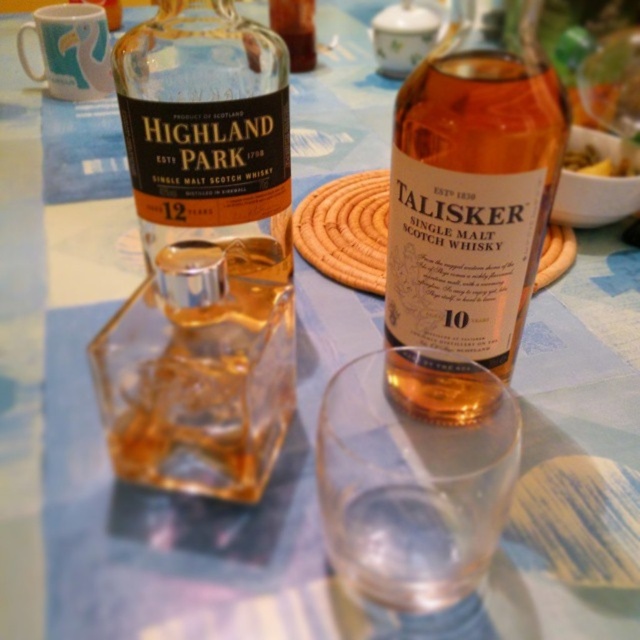
You are at a bar and see two bottles of Scotch whisky on the table. The bottles are labeled as matte glass bottle at center and amber glass bottle at center. Which one is positioned to the left?

The matte glass bottle at center is positioned to the left of the amber glass bottle at center.

You are at a restaurant and see both the amber glass bottle at center and the golden crispy fries at center on the table. Which item is closer to the edge of the table?

The golden crispy fries at center are closer to the edge of the table because the amber glass bottle at center is located below them, meaning it is positioned further inward from the edge.

You are a customer at a restaurant and want to grab the golden crispy fries at center. There is a matte glass bottle at center in the way. Can you reach the fries without moving the bottle?

The matte glass bottle at center is closer to the viewer than golden crispy fries at center, so you can reach the golden crispy fries at center by moving around the bottle or using a utensil to get them without disturbing the bottle.